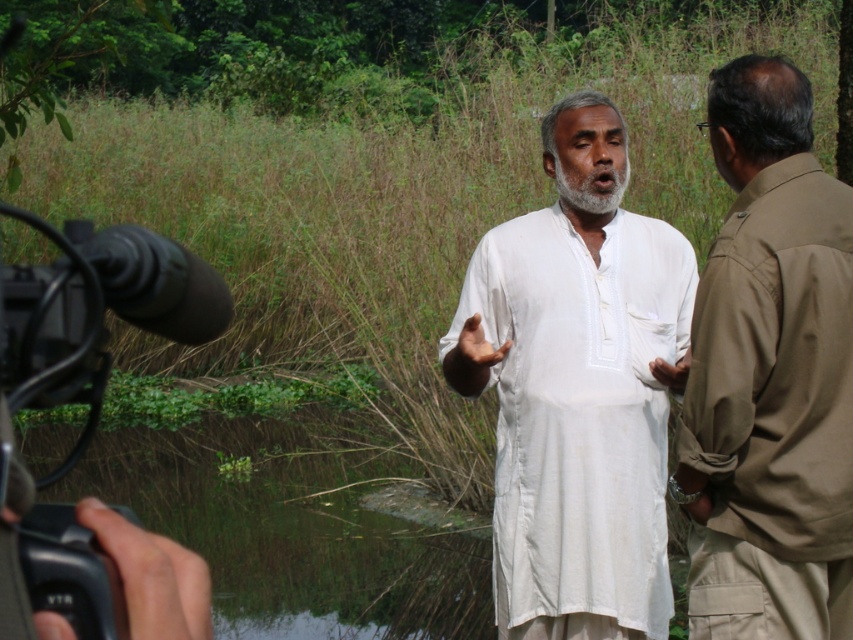
You are a camera operator trying to adjust your focus. You notice the white cotton kurta at center and the black plastic video camera at lower left in your viewfinder. Which object is closer to the camera lens?

The black plastic video camera at lower left is closer to the camera lens because it is positioned above the white cotton kurta at center, implying it is nearer in the frame.

You are a photographer positioned behind the camera. You need to focus on the subject who is closer to you. Which subject should you focus on between the white cotton kurta at center and the khaki cotton shirt at right?

The white cotton kurta at center is closer to you than the khaki cotton shirt at right, so you should focus on the white cotton kurta at center.

You are a photographer trying to capture a closeup shot of the khaki cotton shirt at right and the black plastic video camera at lower left. Which object should you zoom in on to ensure it fills the frame without moving the camera?

The khaki cotton shirt at right has a larger size compared to the black plastic video camera at lower left, so you should zoom in on the khaki cotton shirt at right to ensure it fills the frame without moving the camera.